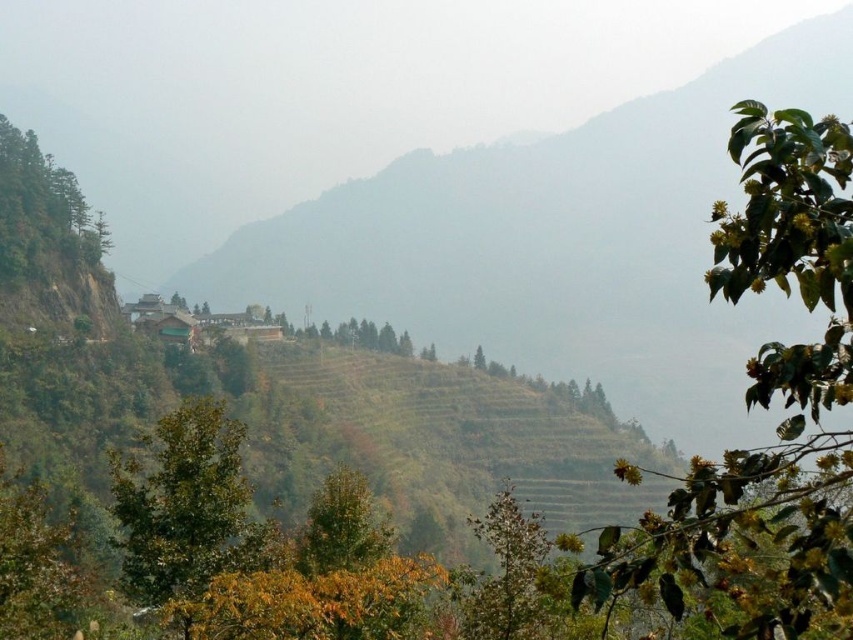
Does green matte tree at upper left lie in front of green leafy tree at center?

No, green matte tree at upper left is behind green leafy tree at center.

Can you confirm if green matte tree at upper left is thinner than green leafy tree at center?

No, green matte tree at upper left is not thinner than green leafy tree at center.

Is point (85, 227) farther from viewer compared to point (498, 540)?

Yes, point (85, 227) is farther from viewer.

The height and width of the screenshot is (640, 853). Identify the location of green matte tree at upper left. (41, 209).

Between point (172, 419) and point (32, 208), which one is positioned in front?

Positioned in front is point (172, 419).

Is green matte tree at lower left to the right of green matte tree at upper left from the viewer's perspective?

Indeed, green matte tree at lower left is positioned on the right side of green matte tree at upper left.

Is point (151, 497) farther from camera compared to point (9, 195)?

That is False.

Where is `green matte tree at lower left`? green matte tree at lower left is located at coordinates (186, 506).

Does green leafy tree at upper right have a greater width compared to green matte tree at lower left?

No, green leafy tree at upper right is not wider than green matte tree at lower left.

Does green leafy tree at upper right have a smaller size compared to green matte tree at lower left?

Yes, green leafy tree at upper right is smaller than green matte tree at lower left.

This screenshot has height=640, width=853. Find the location of `green leafy tree at upper right`. green leafy tree at upper right is located at coordinates (764, 408).